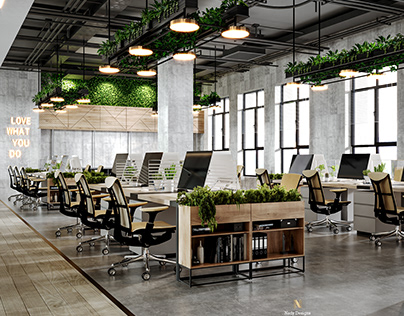
Identify the location of monitors. (120, 159), (64, 161), (55, 157), (73, 161), (153, 154), (190, 159), (225, 159), (301, 161), (363, 160).